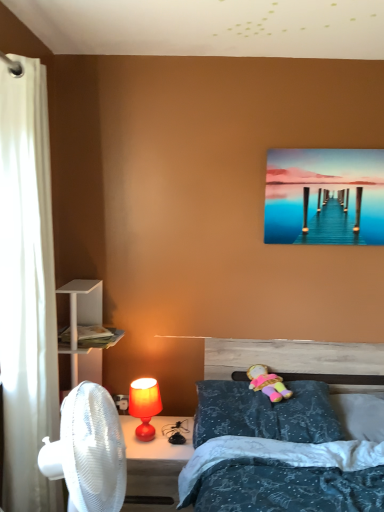
Question: Is white fabric curtain at left bigger than plush fabric doll at center?

Choices:
 (A) yes
 (B) no

Answer: (A)

Question: From the image's perspective, is white fabric curtain at left located beneath plush fabric doll at center?

Choices:
 (A) yes
 (B) no

Answer: (B)

Question: Considering the relative sizes of white fabric curtain at left and plush fabric doll at center in the image provided, is white fabric curtain at left thinner than plush fabric doll at center?

Choices:
 (A) no
 (B) yes

Answer: (B)

Question: Does white fabric curtain at left have a greater height compared to plush fabric doll at center?

Choices:
 (A) yes
 (B) no

Answer: (A)

Question: Considering the relative sizes of white fabric curtain at left and plush fabric doll at center in the image provided, is white fabric curtain at left wider than plush fabric doll at center?

Choices:
 (A) no
 (B) yes

Answer: (A)

Question: In the image, is blue textured pillow at lower right, which appears as the second pillow when viewed from the left, on the left side or the right side of matte orange lamp at lower left?

Choices:
 (A) right
 (B) left

Answer: (A)

Question: Relative to matte orange lamp at lower left, is blue textured pillow at lower right, which appears as the second pillow when viewed from the left, in front or behind?

Choices:
 (A) behind
 (B) front

Answer: (B)

Question: Is point (350, 411) positioned closer to the camera than point (137, 388)?

Choices:
 (A) closer
 (B) farther

Answer: (B)

Question: Looking at their shapes, would you say blue textured pillow at lower right, the first pillow in the right-to-left sequence, is wider or thinner than matte orange lamp at lower left?

Choices:
 (A) thin
 (B) wide

Answer: (B)

Question: Considering their positions, is metallic glossy pier at upper right located in front of or behind matte red lamp at lower center?

Choices:
 (A) behind
 (B) front

Answer: (A)

Question: Is point (342, 215) positioned closer to the camera than point (168, 420)?

Choices:
 (A) closer
 (B) farther

Answer: (A)

Question: From the image's perspective, is metallic glossy pier at upper right positioned above or below matte red lamp at lower center?

Choices:
 (A) below
 (B) above

Answer: (B)

Question: Would you say metallic glossy pier at upper right is to the left or to the right of matte red lamp at lower center in the picture?

Choices:
 (A) left
 (B) right

Answer: (B)

Question: Is blue textured pillow at center, the 1th pillow in the left-to-right sequence, spatially inside metallic glossy pier at upper right, or outside of it?

Choices:
 (A) inside
 (B) outside

Answer: (B)

Question: In the image, is blue textured pillow at center, the 1th pillow in the left-to-right sequence, positioned in front of or behind metallic glossy pier at upper right?

Choices:
 (A) behind
 (B) front

Answer: (B)